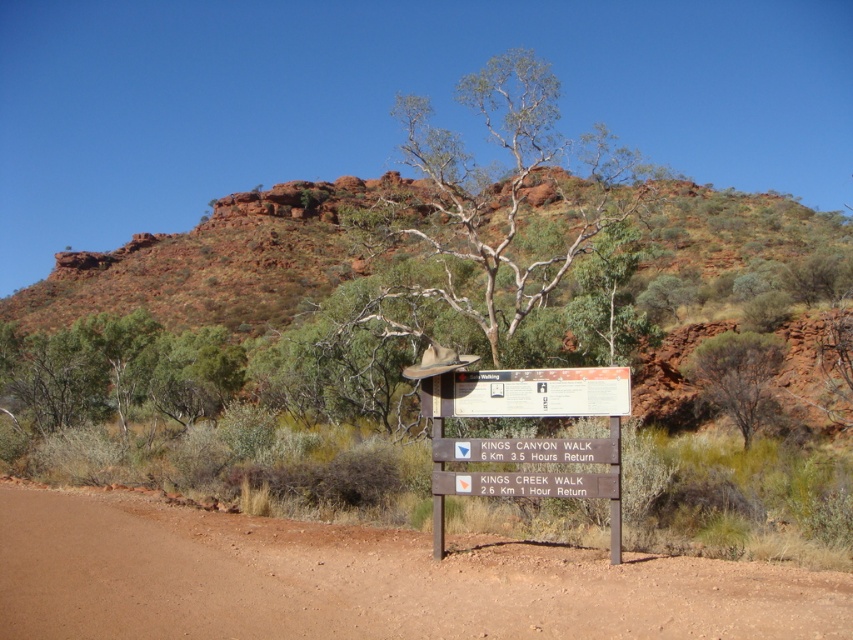
You are standing at the signpost and want to go to the point labeled as point (90,252). Which direction should you walk relative to the point (518,474)?

You should walk towards the direction opposite of point (518,474) because point (90,252) is located behind it.